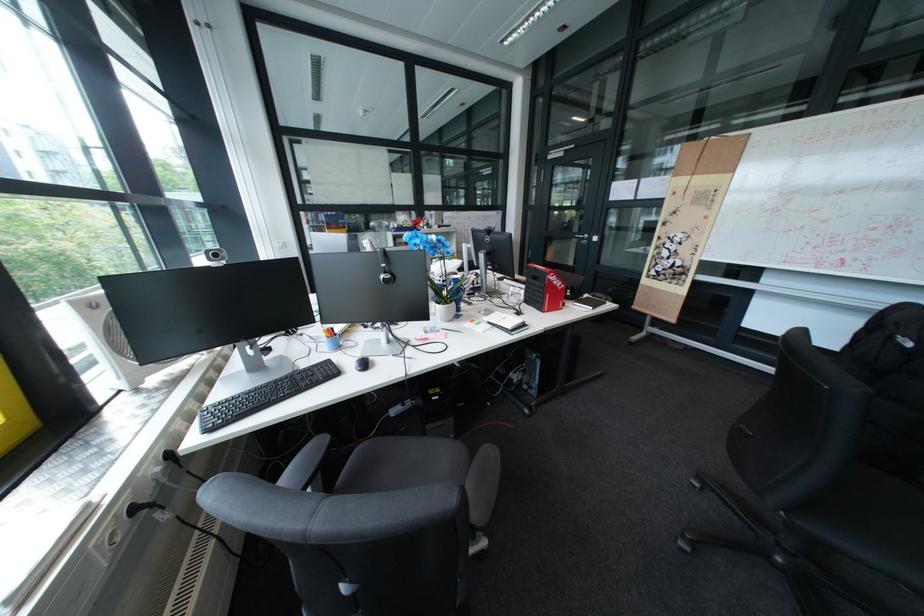
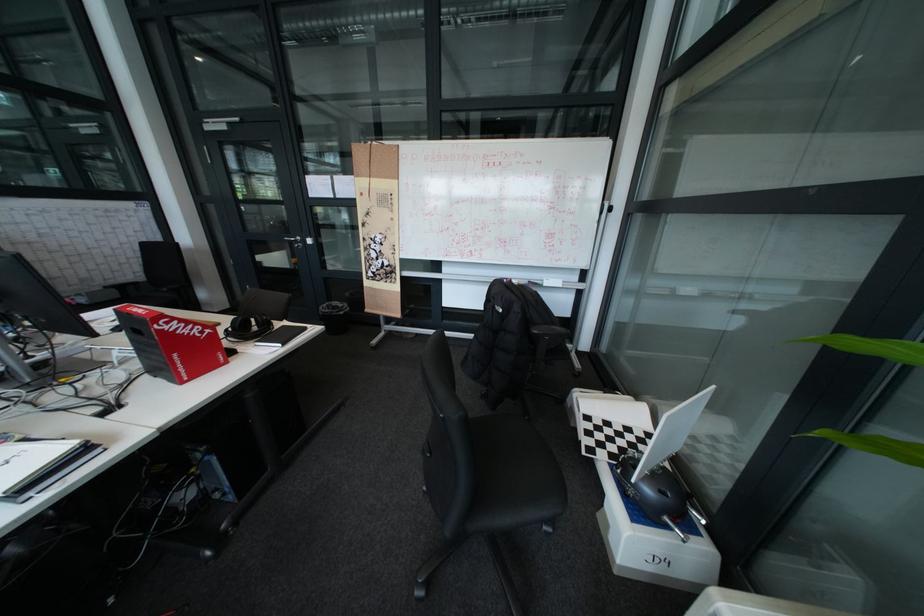
The point at (606, 294) is marked in the first image. Where is the corresponding point in the second image?

(341, 304)